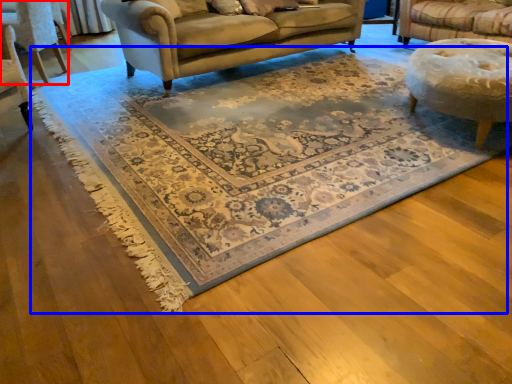
Question: Which of the following is the closest to the observer, chair (highlighted by a red box) or mat (highlighted by a blue box)?

Choices:
 (A) chair
 (B) mat

Answer: (B)